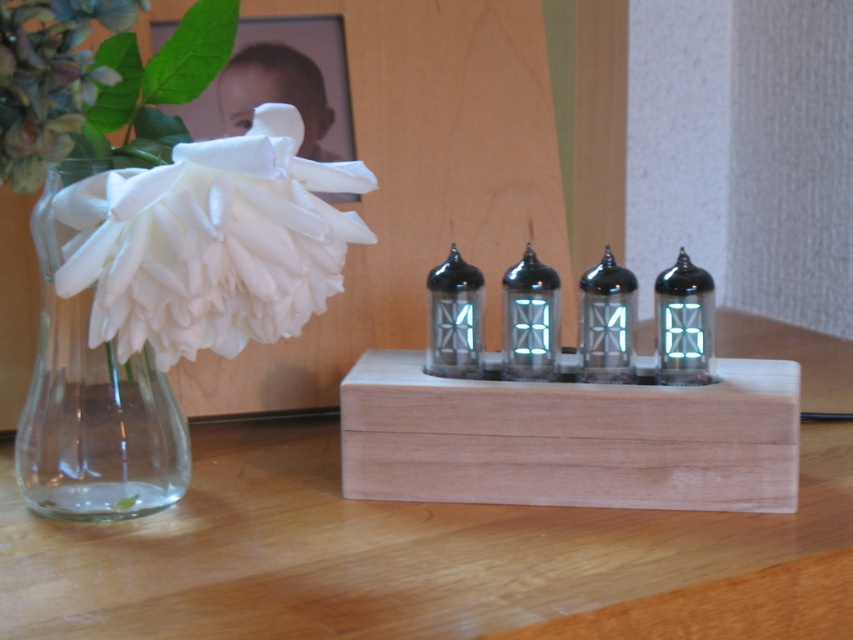
Question: Is natural wood table at center thinner than white silk flower at left?

Choices:
 (A) no
 (B) yes

Answer: (A)

Question: Among these objects, which one is farthest from the camera?

Choices:
 (A) wooden frame at upper left
 (B) natural wood table at center
 (C) transparent glass vase at left
 (D) white silk flower at left

Answer: (A)

Question: Which point is closer to the camera?

Choices:
 (A) (152, 364)
 (B) (520, 628)

Answer: (B)

Question: Which object appears farthest from the camera in this image?

Choices:
 (A) transparent glass vase at left
 (B) white silk flower at left

Answer: (A)

Question: Can you confirm if transparent glass vase at left is wider than wooden frame at upper left?

Choices:
 (A) yes
 (B) no

Answer: (B)

Question: In this image, where is white silk flower at left located relative to transparent glass vase at left?

Choices:
 (A) left
 (B) right

Answer: (B)